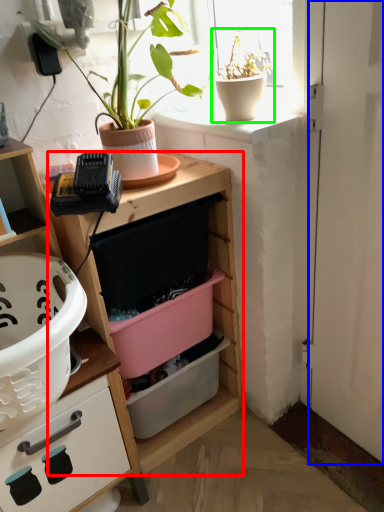
Question: Estimate the real-world distances between objects in this image. Which object is farther from shelf (highlighted by a red box), door (highlighted by a blue box) or houseplant (highlighted by a green box)?

Choices:
 (A) door
 (B) houseplant

Answer: (B)